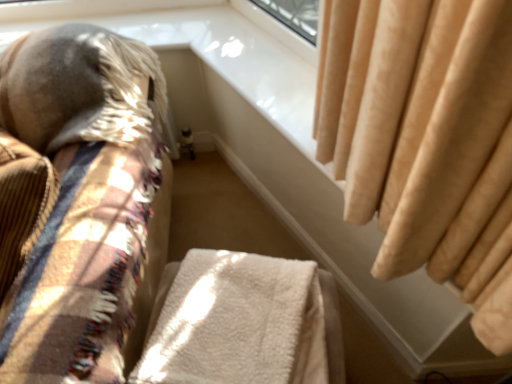
Where is `white fluffy blanket at center`? This screenshot has width=512, height=384. white fluffy blanket at center is located at coordinates (238, 323).

In the scene shown: In order to face beige velvet curtain at upper right, should I rotate leftwards or rightwards?

To align with it, rotate right about 8.401°.

I want to click on soft beige fabric cushion at left, so click(82, 198).

Find the location of a particular element. Image resolution: width=512 pixels, height=384 pixels. white fluffy blanket at center is located at coordinates (238, 323).

Based on their sizes in the image, would you say soft beige fabric cushion at left is bigger or smaller than beige velvet curtain at upper right?

soft beige fabric cushion at left is bigger than beige velvet curtain at upper right.

Based on the photo, considering the positions of objects soft beige fabric cushion at left and beige velvet curtain at upper right in the image provided, who is more to the left, soft beige fabric cushion at left or beige velvet curtain at upper right?

Positioned to the left is soft beige fabric cushion at left.

Considering the relative sizes of soft beige fabric cushion at left and beige velvet curtain at upper right in the image provided, is soft beige fabric cushion at left taller than beige velvet curtain at upper right?

Correct, soft beige fabric cushion at left is much taller as beige velvet curtain at upper right.

Which is nearer, (104,189) or (409,206)?

The point (409,206) is closer.

Does point (278, 366) lie behind point (36, 321)?

Yes, it is.

From a real-world perspective, relative to soft beige fabric cushion at left, is white fluffy blanket at center vertically above or below?

Clearly, from a real-world perspective, white fluffy blanket at center is above soft beige fabric cushion at left.

Is white fluffy blanket at center facing away from soft beige fabric cushion at left?

No, soft beige fabric cushion at left is not at the back of white fluffy blanket at center.

Does white fluffy blanket at center have a lesser height compared to soft beige fabric cushion at left?

Yes.

Locate an element on the screen. This screenshot has width=512, height=384. curtain above the soft beige fabric cushion at left (from the image's perspective) is located at coordinates (421, 129).

From the image's perspective, would you say beige velvet curtain at upper right is positioned over soft beige fabric cushion at left?

Yes.

Is point (490, 131) closer to viewer compared to point (47, 336)?

Yes, it is.

Is beige velvet curtain at upper right not close to soft beige fabric cushion at left?

No, beige velvet curtain at upper right is in close proximity to soft beige fabric cushion at left.

Is beige velvet curtain at upper right facing towards white fluffy blanket at center?

Yes.

Considering the relative sizes of beige velvet curtain at upper right and white fluffy blanket at center in the image provided, is beige velvet curtain at upper right wider than white fluffy blanket at center?

Yes, beige velvet curtain at upper right is wider than white fluffy blanket at center.

This screenshot has height=384, width=512. I want to click on blanket in front of the beige velvet curtain at upper right, so click(x=238, y=323).

In the scene shown: Which is nearer, (335, 46) or (204, 304)?

The point (335, 46) is closer to the camera.

From a real-world perspective, is soft beige fabric cushion at left beneath white fluffy blanket at center?

Indeed, from a real-world perspective, soft beige fabric cushion at left is positioned beneath white fluffy blanket at center.

Between soft beige fabric cushion at left and white fluffy blanket at center, which one has less height?

With less height is white fluffy blanket at center.

Is soft beige fabric cushion at left at the left side of white fluffy blanket at center?

Indeed, soft beige fabric cushion at left is positioned on the left side of white fluffy blanket at center.

Are soft beige fabric cushion at left and white fluffy blanket at center making contact?

soft beige fabric cushion at left and white fluffy blanket at center are clearly separated.

Considering the points (209, 304) and (433, 13), which point is in front, point (209, 304) or point (433, 13)?

The point (433, 13) is closer to the camera.

Relative to beige velvet curtain at upper right, is white fluffy blanket at center in front or behind?

white fluffy blanket at center is positioned closer to the viewer than beige velvet curtain at upper right.

Does white fluffy blanket at center turn towards beige velvet curtain at upper right?

No, white fluffy blanket at center does not turn towards beige velvet curtain at upper right.

Which object is wider, white fluffy blanket at center or beige velvet curtain at upper right?

With larger width is beige velvet curtain at upper right.

Where is `furniture lying in front of the beige velvet curtain at upper right`? Image resolution: width=512 pixels, height=384 pixels. furniture lying in front of the beige velvet curtain at upper right is located at coordinates (82, 198).

This screenshot has height=384, width=512. Find the location of `furniture below the white fluffy blanket at center (from a real-world perspective)`. furniture below the white fluffy blanket at center (from a real-world perspective) is located at coordinates (82, 198).

From the picture: Looking at the image, which one is located closer to beige velvet curtain at upper right, soft beige fabric cushion at left or white fluffy blanket at center?

Based on the image, white fluffy blanket at center appears to be nearer to beige velvet curtain at upper right.

Based on their spatial positions, is beige velvet curtain at upper right or white fluffy blanket at center further from soft beige fabric cushion at left?

Among the two, beige velvet curtain at upper right is located further to soft beige fabric cushion at left.

Estimate the real-world distances between objects in this image. Which object is closer to beige velvet curtain at upper right, white fluffy blanket at center or soft beige fabric cushion at left?

Based on the image, white fluffy blanket at center appears to be nearer to beige velvet curtain at upper right.

Estimate the real-world distances between objects in this image. Which object is closer to white fluffy blanket at center, beige velvet curtain at upper right or soft beige fabric cushion at left?

soft beige fabric cushion at left lies closer to white fluffy blanket at center than the other object.

Estimate the real-world distances between objects in this image. Which object is closer to white fluffy blanket at center, soft beige fabric cushion at left or beige velvet curtain at upper right?

soft beige fabric cushion at left lies closer to white fluffy blanket at center than the other object.

From the image, which object appears to be farther from soft beige fabric cushion at left, white fluffy blanket at center or beige velvet curtain at upper right?

Among the two, beige velvet curtain at upper right is located further to soft beige fabric cushion at left.

At what (x,y) coordinates should I click in order to perform the action: click on blanket between soft beige fabric cushion at left and beige velvet curtain at upper right. Please return your answer as a coordinate pair (x, y). Looking at the image, I should click on (238, 323).